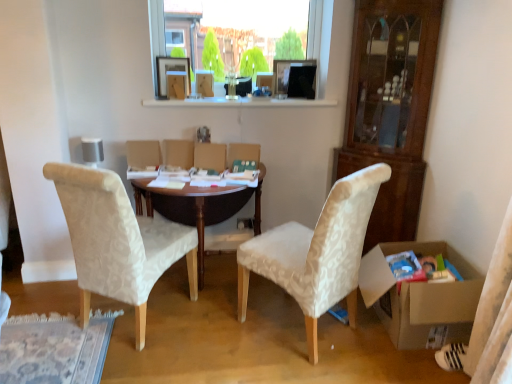
Find the location of a particular element. The width and height of the screenshot is (512, 384). vacant area on top of brown wooden table at center (from a real-world perspective) is located at coordinates (197, 180).